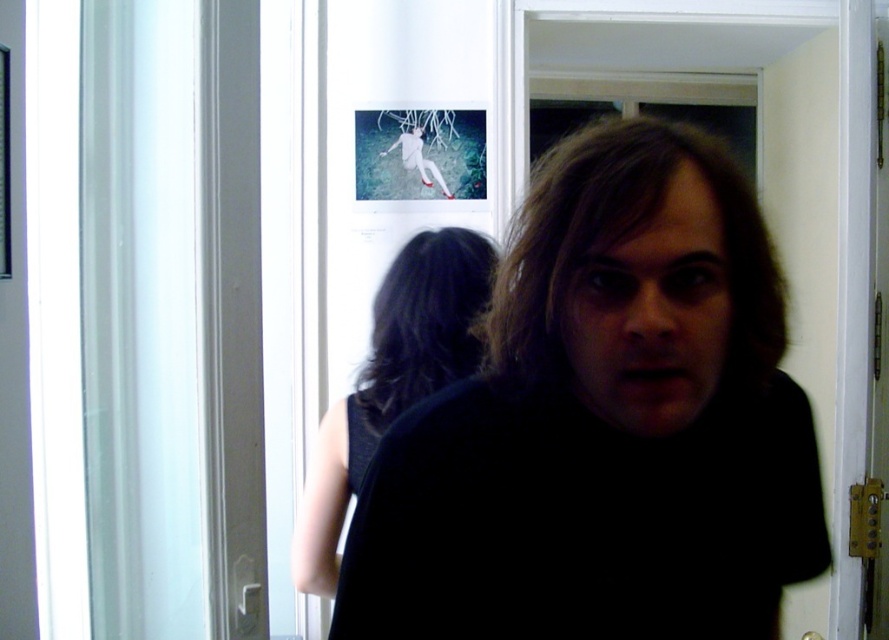
You are a photographer setting up for an event in this gallery. You have a camera that can focus on objects within a 4 feet range. There is a black fabric dress at center and a person with long dark hair walking away from the camera. Can you focus on both subjects simultaneously?

The black fabric dress at center and the person with long dark hair are 4.10 feet apart. Since the camera can focus within a 4 feet range, the distance between them exceeds the camera focus range, so you cannot focus on both subjects at the same time.

You are standing in the gallery and want to move from the point at coordinate (653, 202) to the point at coordinate (449, 280). Can you walk directly towards the second point without any obstacles?

Point (653, 202) is in front of point (449, 280), so you cannot walk directly towards the second point because the first point is blocking the path.